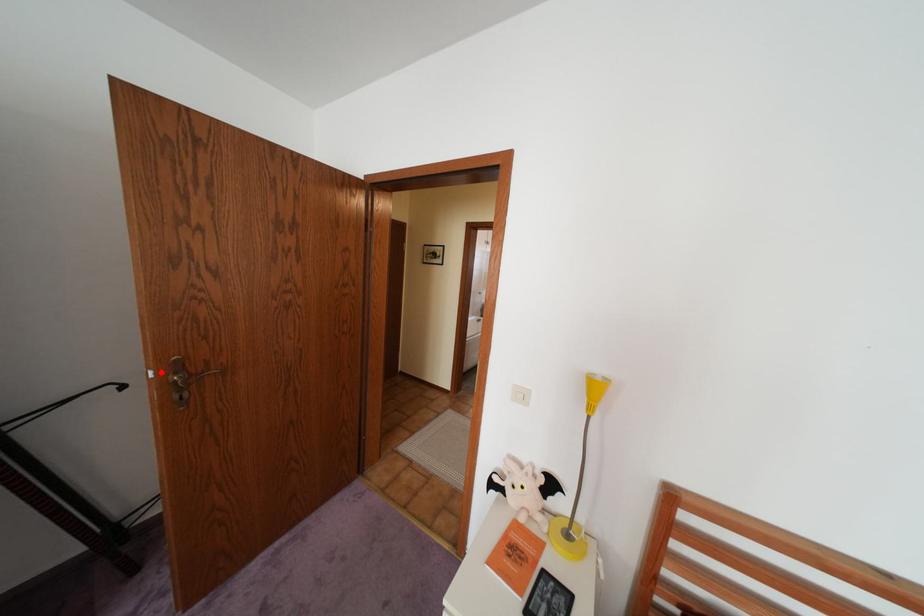
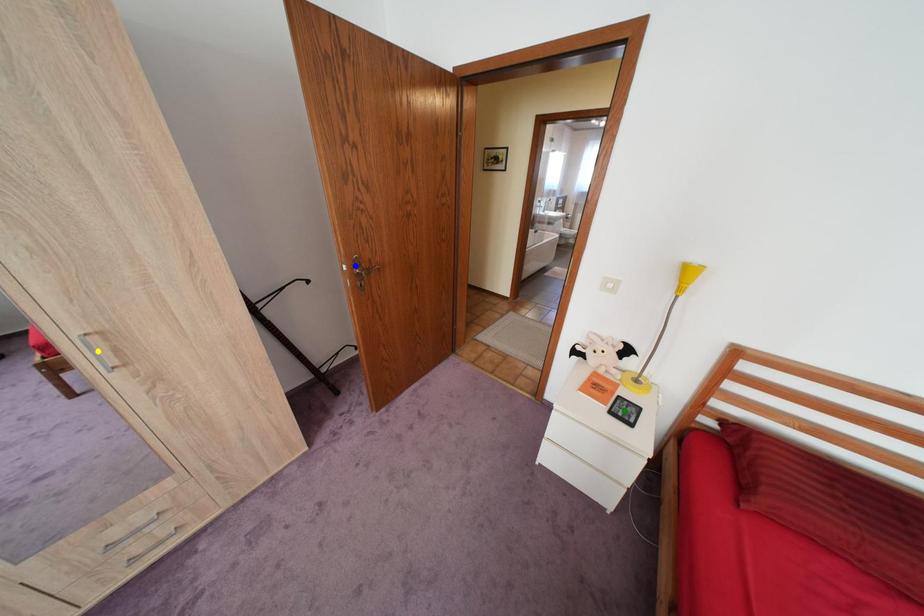
Question: I am providing you with two images of the same scene from different viewpoints. A red point is marked on the first image. You are given multiple points on the second image. In image 2, which mark is for the same physical point as the one in image 1?

Choices:
 (A) green point
 (B) blue point
 (C) yellow point

Answer: (B)